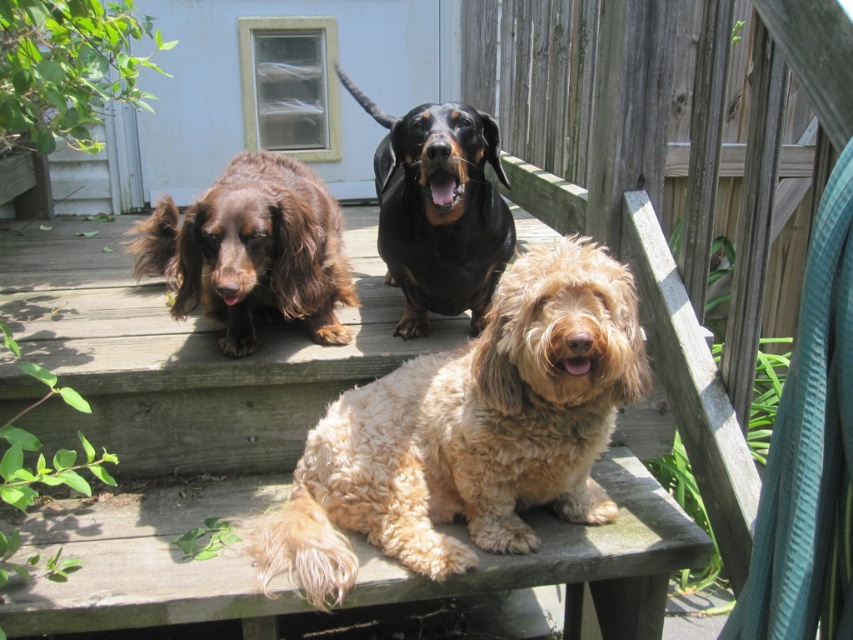
Question: Among these objects, which one is farthest from the camera?

Choices:
 (A) brown furry dog at left
 (B) black shiny dachshund at center

Answer: (A)

Question: Which object is closer to the camera taking this photo?

Choices:
 (A) brown furry dog at left
 (B) black shiny dachshund at center
 (C) fuzzy golden dog at center

Answer: (C)

Question: Is fuzzy golden dog at center positioned behind brown furry dog at left?

Choices:
 (A) no
 (B) yes

Answer: (A)

Question: Based on their relative distances, which object is farther from the brown furry dog at left?

Choices:
 (A) black shiny dachshund at center
 (B) fuzzy golden dog at center

Answer: (B)

Question: Observing the image, what is the correct spatial positioning of fuzzy golden dog at center in reference to black shiny dachshund at center?

Choices:
 (A) above
 (B) below

Answer: (B)

Question: Is fuzzy golden dog at center further to camera compared to black shiny dachshund at center?

Choices:
 (A) yes
 (B) no

Answer: (B)